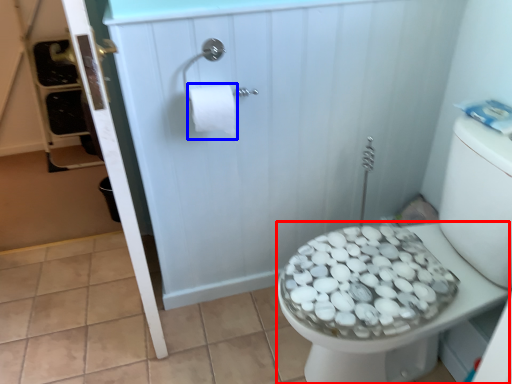
Question: Which of the following is the farthest to the observer, bidet (highlighted by a red box) or toilet paper (highlighted by a blue box)?

Choices:
 (A) bidet
 (B) toilet paper

Answer: (B)